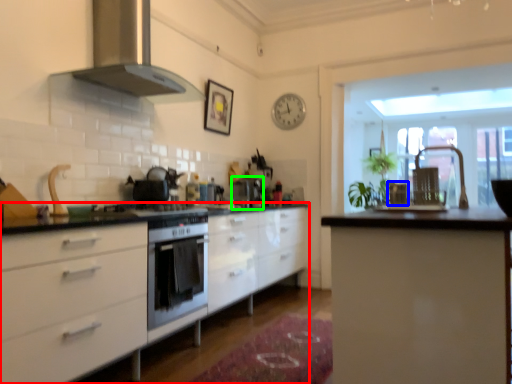
Question: Which object is the closest to the cabinetry (highlighted by a red box)? Choose among these: chair (highlighted by a blue box) or coffee machine (highlighted by a green box).

Choices:
 (A) chair
 (B) coffee machine

Answer: (B)